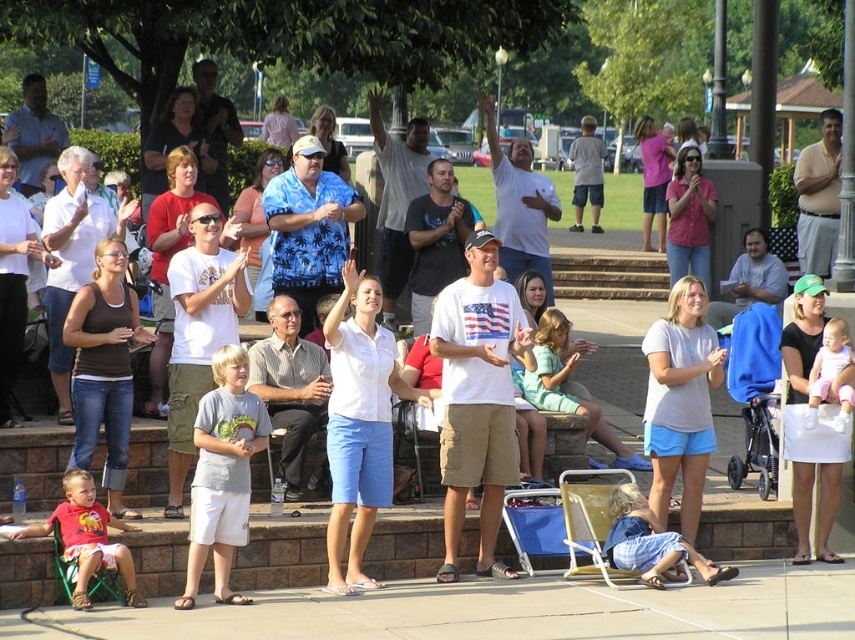
You are a photographer trying to capture a photo of the crowd while ensuring both the matte red shirt at lower left and the pink fabric baby at center are visible. Based on their positions, which object is more likely to block the other if you move the camera slightly to the right?

The matte red shirt at lower left might block the pink fabric baby at center because it is wider and positioned to the left, so moving the camera right could cause it to overlap with the baby.

You are a photographer at the event and want to capture a photo that includes both the matte red shirt at lower left and the denim shorts at lower center. Which object should you adjust your camera angle to focus on first to ensure both are in frame?

The matte red shirt at lower left is much taller than the denim shorts at lower center. To ensure both are in frame, focus on the taller object first, which is the matte red shirt at lower left, then adjust the angle to include the denim shorts at lower center.

You are a photographer trying to capture a candid shot of the crowd at this event. You notice a point at coordinates point (87, 538). What object is this point located on?

The point (87, 538) is located on the matte red shirt at lower left.